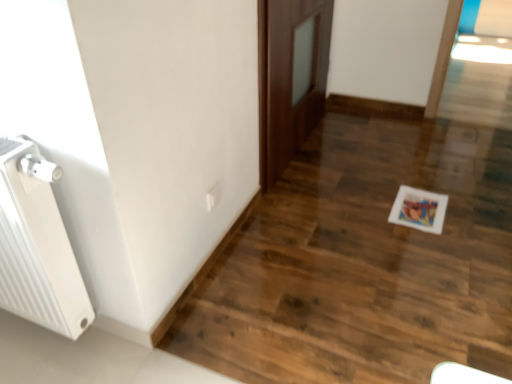
Question: Is white ribbed radiator at left aimed at white plastic electric outlet at lower center?

Choices:
 (A) no
 (B) yes

Answer: (A)

Question: Does white ribbed radiator at left have a larger size compared to white plastic electric outlet at lower center?

Choices:
 (A) no
 (B) yes

Answer: (B)

Question: Does white ribbed radiator at left come behind white plastic electric outlet at lower center?

Choices:
 (A) no
 (B) yes

Answer: (A)

Question: From the image's perspective, would you say white ribbed radiator at left is shown under white plastic electric outlet at lower center?

Choices:
 (A) no
 (B) yes

Answer: (B)

Question: From the image's perspective, does white ribbed radiator at left appear higher than white plastic electric outlet at lower center?

Choices:
 (A) no
 (B) yes

Answer: (A)

Question: Considering the relative sizes of white ribbed radiator at left and white plastic electric outlet at lower center in the image provided, is white ribbed radiator at left wider than white plastic electric outlet at lower center?

Choices:
 (A) no
 (B) yes

Answer: (B)

Question: Can you confirm if brown wooden door at center is thinner than white ribbed radiator at left?

Choices:
 (A) yes
 (B) no

Answer: (A)

Question: Considering the relative sizes of brown wooden door at center and white ribbed radiator at left in the image provided, is brown wooden door at center bigger than white ribbed radiator at left?

Choices:
 (A) yes
 (B) no

Answer: (A)

Question: Is brown wooden door at center far from white ribbed radiator at left?

Choices:
 (A) no
 (B) yes

Answer: (B)

Question: Is brown wooden door at center to the right of white ribbed radiator at left from the viewer's perspective?

Choices:
 (A) yes
 (B) no

Answer: (A)

Question: Would you say brown wooden door at center is outside white ribbed radiator at left?

Choices:
 (A) no
 (B) yes

Answer: (B)

Question: Is brown wooden door at center behind white ribbed radiator at left?

Choices:
 (A) yes
 (B) no

Answer: (A)

Question: From the image's perspective, is white plastic electric outlet at lower center below brown wooden door at center?

Choices:
 (A) no
 (B) yes

Answer: (B)